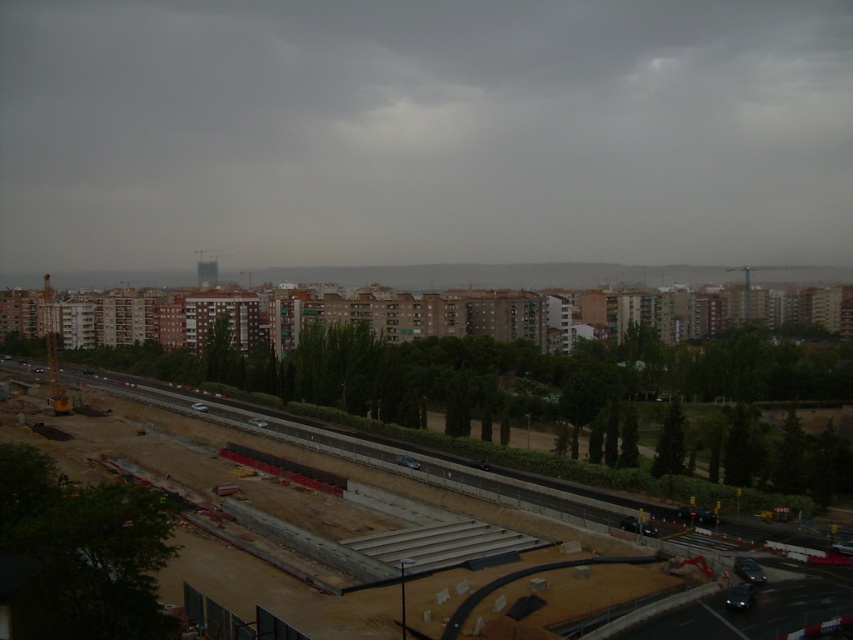
Question: Which object is closer to the camera taking this photo?

Choices:
 (A) green leafy tree at center
 (B) concrete at center

Answer: (B)

Question: Is green leafy tree at lower left below green leafy tree at center?

Choices:
 (A) yes
 (B) no

Answer: (A)

Question: Is concrete at center positioned behind green leafy tree at center?

Choices:
 (A) yes
 (B) no

Answer: (B)

Question: Among these points, which one is farthest from the camera?

Choices:
 (A) (x=213, y=321)
 (B) (x=77, y=520)

Answer: (A)

Question: Based on their relative distances, which object is farther from the green leafy tree at lower left?

Choices:
 (A) concrete at center
 (B) green leafy tree at center

Answer: (B)

Question: Where is concrete at center located in relation to green leafy tree at center in the image?

Choices:
 (A) right
 (B) left

Answer: (A)